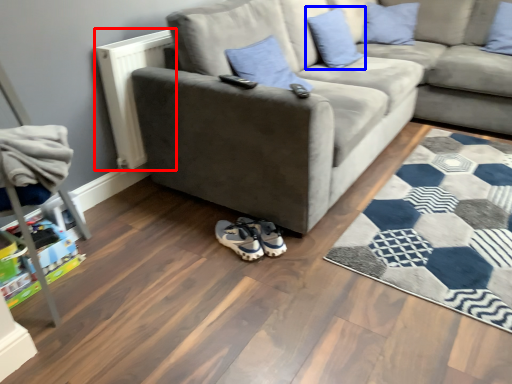
Question: Which point is further to the camera, radiator (highlighted by a red box) or pillow (highlighted by a blue box)?

Choices:
 (A) radiator
 (B) pillow

Answer: (B)